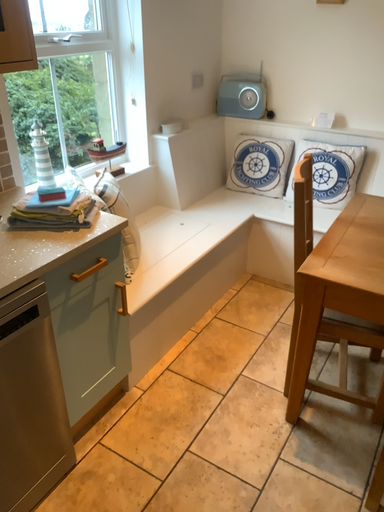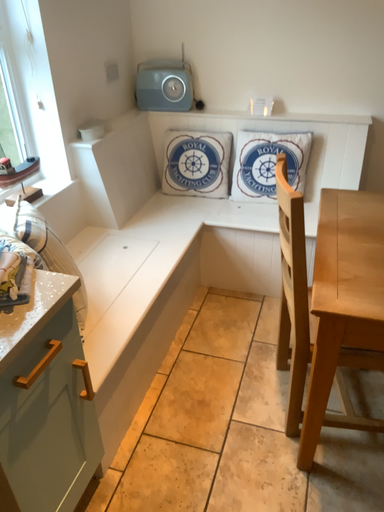
Question: Which way did the camera rotate in the video?

Choices:
 (A) rotated left
 (B) rotated right

Answer: (B)